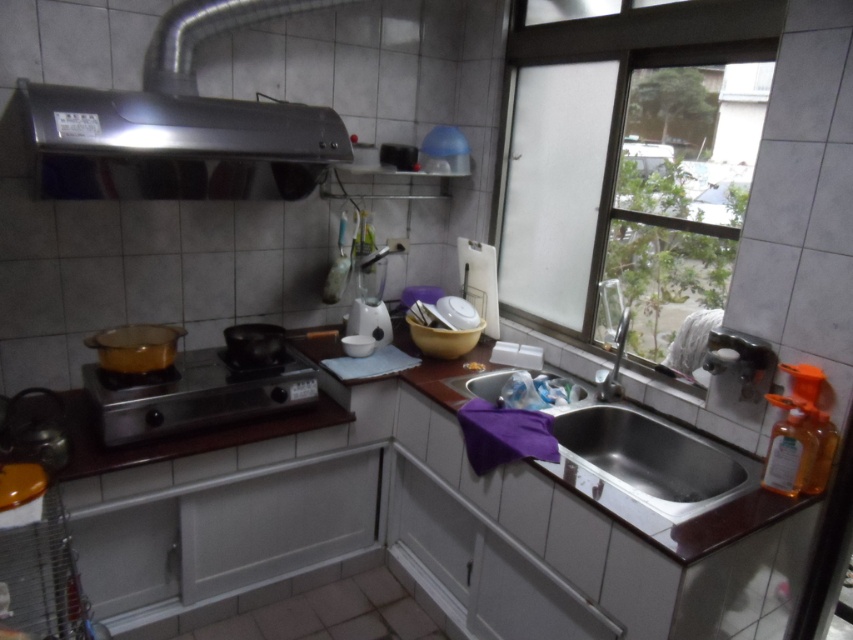
Question: Which object is closer to the camera taking this photo?

Choices:
 (A) stainless steel sink at lower center
 (B) metallic stove at lower left
 (C) satin nickel faucet at sink right
 (D) stainless steel exhaust hood at upper left

Answer: (A)

Question: Which point is farther to the camera?

Choices:
 (A) (271, 108)
 (B) (573, 454)

Answer: (A)

Question: Does stainless steel exhaust hood at upper left have a lesser width compared to metallic stove at lower left?

Choices:
 (A) no
 (B) yes

Answer: (A)

Question: Which point is closer to the camera?

Choices:
 (A) stainless steel sink at lower center
 (B) stainless steel exhaust hood at upper left
 (C) transparent glass window at upper right

Answer: (A)

Question: Does stainless steel sink at lower center have a greater width compared to metallic stove at lower left?

Choices:
 (A) yes
 (B) no

Answer: (B)

Question: Is the position of transparent glass window at upper right less distant than that of stainless steel sink at lower center?

Choices:
 (A) yes
 (B) no

Answer: (B)